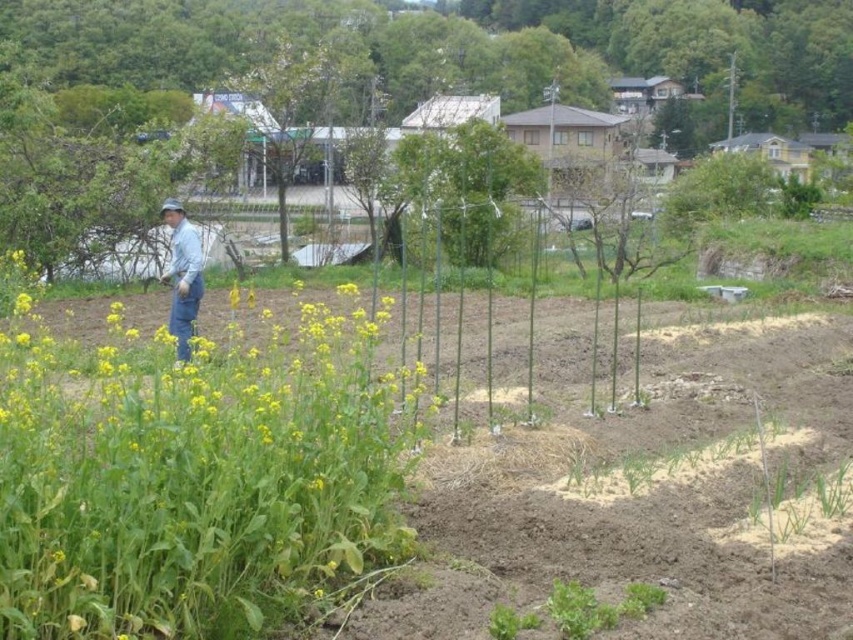
Question: Which point is closer to the camera?

Choices:
 (A) (184, 243)
 (B) (198, 378)
 (C) (328, 93)
 (D) (190, 61)

Answer: (B)

Question: Can you confirm if green leafy tree at upper center is positioned to the left of blue denim jeans at center?

Choices:
 (A) yes
 (B) no

Answer: (B)

Question: Where is green leafy plant at center located in relation to blue denim jeans at center in the image?

Choices:
 (A) below
 (B) above

Answer: (A)

Question: Among these points, which one is farthest from the camera?

Choices:
 (A) (231, 0)
 (B) (283, 225)

Answer: (A)

Question: Does green leafy plant at center appear over green leafy tree at upper center?

Choices:
 (A) no
 (B) yes

Answer: (A)

Question: Among these points, which one is nearest to the camera?

Choices:
 (A) (175, 305)
 (B) (280, 160)
 (C) (7, 595)
 (D) (848, 29)

Answer: (C)